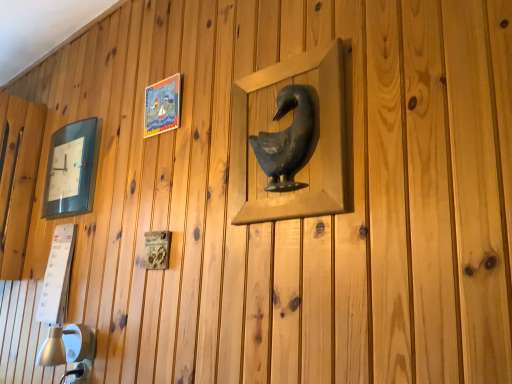
Question: Can you confirm if matte black clock at left, placed as the third picture frame when sorted from front to back, is taller than matte plastic picture frame at upper left, the 2th picture frame when ordered from left to right?

Choices:
 (A) no
 (B) yes

Answer: (B)

Question: Is matte black clock at left, placed as the third picture frame when sorted from front to back, outside of matte plastic picture frame at upper left, the second picture frame when ordered from front to back?

Choices:
 (A) no
 (B) yes

Answer: (B)

Question: Does matte black clock at left, the first picture frame from the back, have a lesser width compared to matte plastic picture frame at upper left, the 2th picture frame when ordered from left to right?

Choices:
 (A) no
 (B) yes

Answer: (A)

Question: Considering the relative positions of matte black clock at left, the 1th picture frame when ordered from left to right, and matte plastic picture frame at upper left, marked as the 2th picture frame in a right-to-left arrangement, in the image provided, is matte black clock at left, the 1th picture frame when ordered from left to right, in front of matte plastic picture frame at upper left, marked as the 2th picture frame in a right-to-left arrangement,?

Choices:
 (A) no
 (B) yes

Answer: (A)

Question: Does matte black clock at left, the first picture frame from the back, have a lesser height compared to matte plastic picture frame at upper left, the 2th picture frame when ordered from back to front?

Choices:
 (A) yes
 (B) no

Answer: (B)

Question: From the image's perspective, relative to matte plastic picture frame at upper left, marked as the 2th picture frame in a right-to-left arrangement, is matte black clock at left, the first picture frame from the back, above or below?

Choices:
 (A) above
 (B) below

Answer: (B)

Question: From a real-world perspective, is matte black clock at left, the first picture frame from the back, above or below matte plastic picture frame at upper left, marked as the 2th picture frame in a right-to-left arrangement?

Choices:
 (A) above
 (B) below

Answer: (B)

Question: Considering the positions of matte black clock at left, placed as the third picture frame when sorted from front to back, and matte plastic picture frame at upper left, the 2th picture frame when ordered from left to right, in the image, is matte black clock at left, placed as the third picture frame when sorted from front to back, taller or shorter than matte plastic picture frame at upper left, the 2th picture frame when ordered from left to right,?

Choices:
 (A) short
 (B) tall

Answer: (B)

Question: Is matte black clock at left, placed as the third picture frame when sorted from front to back, inside or outside of matte plastic picture frame at upper left, the 2th picture frame when ordered from left to right?

Choices:
 (A) inside
 (B) outside

Answer: (B)

Question: Is matte plastic picture frame at upper left, the second picture frame when ordered from front to back, bigger or smaller than matte black clock at left, placed as the third picture frame when sorted from front to back?

Choices:
 (A) small
 (B) big

Answer: (A)

Question: Does point (143, 129) appear closer or farther from the camera than point (72, 180)?

Choices:
 (A) farther
 (B) closer

Answer: (B)

Question: Visually, is matte plastic picture frame at upper left, the second picture frame when ordered from front to back, positioned to the left or to the right of matte black clock at left, the 1th picture frame when ordered from left to right?

Choices:
 (A) left
 (B) right

Answer: (B)

Question: Which is correct: matte plastic picture frame at upper left, marked as the 2th picture frame in a right-to-left arrangement, is inside matte black clock at left, placed as the third picture frame when sorted from front to back, or outside of it?

Choices:
 (A) outside
 (B) inside

Answer: (A)

Question: Would you say matte plastic picture frame at upper left, the second picture frame when ordered from front to back, is to the left or to the right of metallic gray bird at center, which is the third picture frame from left to right, in the picture?

Choices:
 (A) right
 (B) left

Answer: (B)

Question: Looking at their shapes, would you say matte plastic picture frame at upper left, the 2th picture frame when ordered from left to right, is wider or thinner than metallic gray bird at center, the first picture frame in the front-to-back sequence?

Choices:
 (A) wide
 (B) thin

Answer: (B)